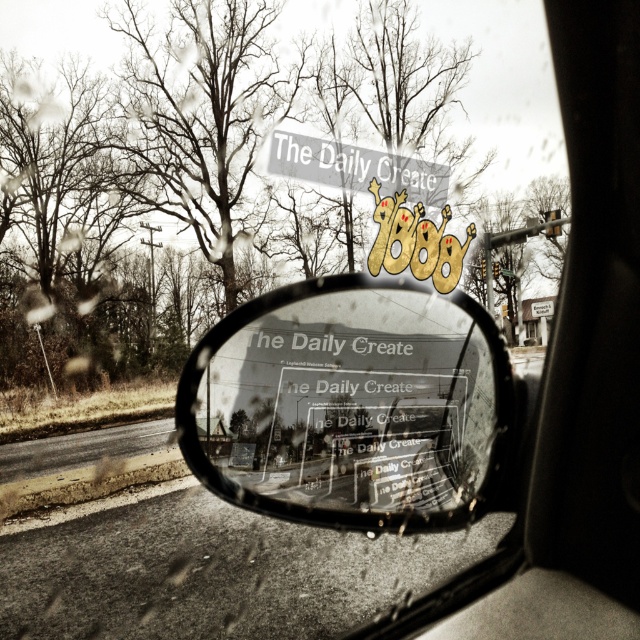
Based on the photo, is transparent glass mirror at center positioned behind gray matte sign at upper center?

That is False.

Can you confirm if transparent glass mirror at center is wider than gray matte sign at upper center?

Correct, the width of transparent glass mirror at center exceeds that of gray matte sign at upper center.

Does point (344, 384) come behind point (436, 179)?

No, (344, 384) is in front of (436, 179).

Image resolution: width=640 pixels, height=640 pixels. In order to click on transparent glass mirror at center in this screenshot , I will do [349, 404].